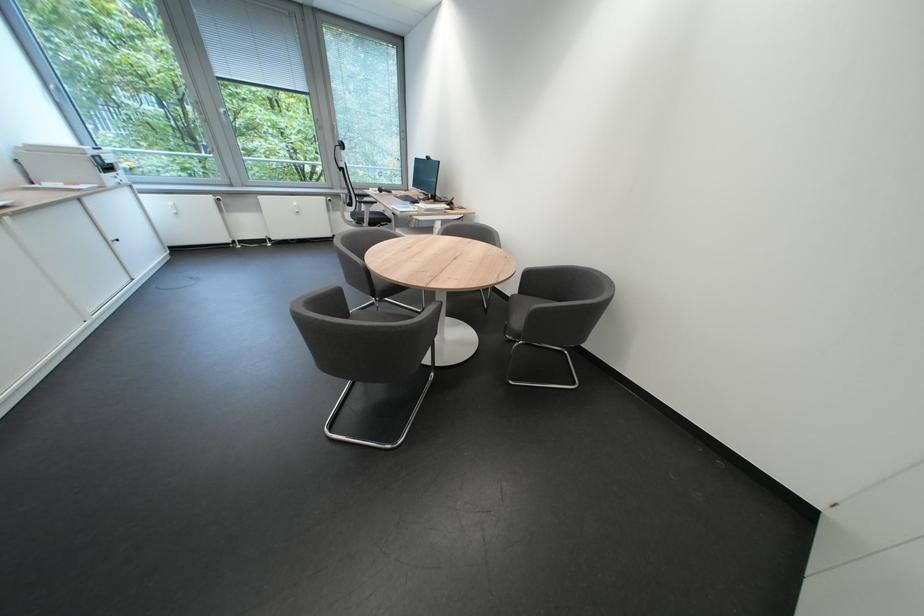
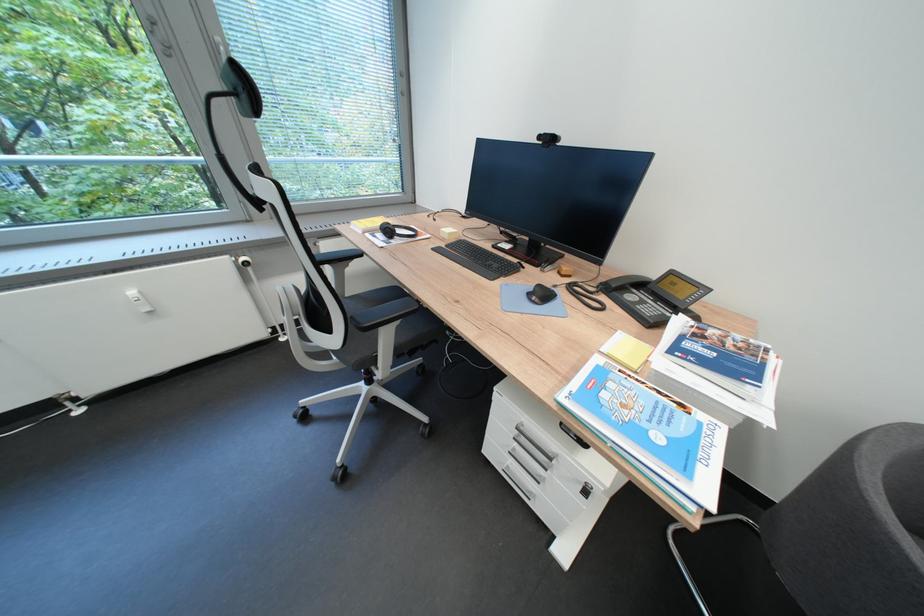
Which direction would the cameraman need to move to produce the second image?

The cameraman walked toward left, forward.